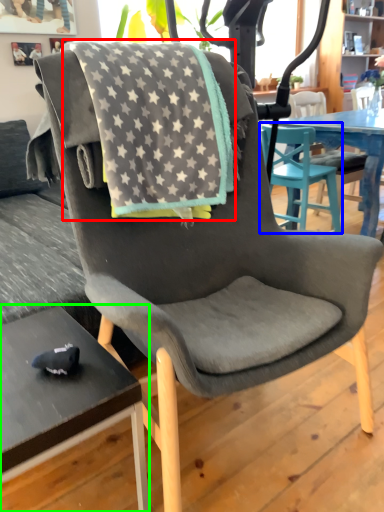
Question: Which is farther away from beach towel (highlighted by a red box)? chair (highlighted by a blue box) or desk (highlighted by a green box)?

Choices:
 (A) chair
 (B) desk

Answer: (A)